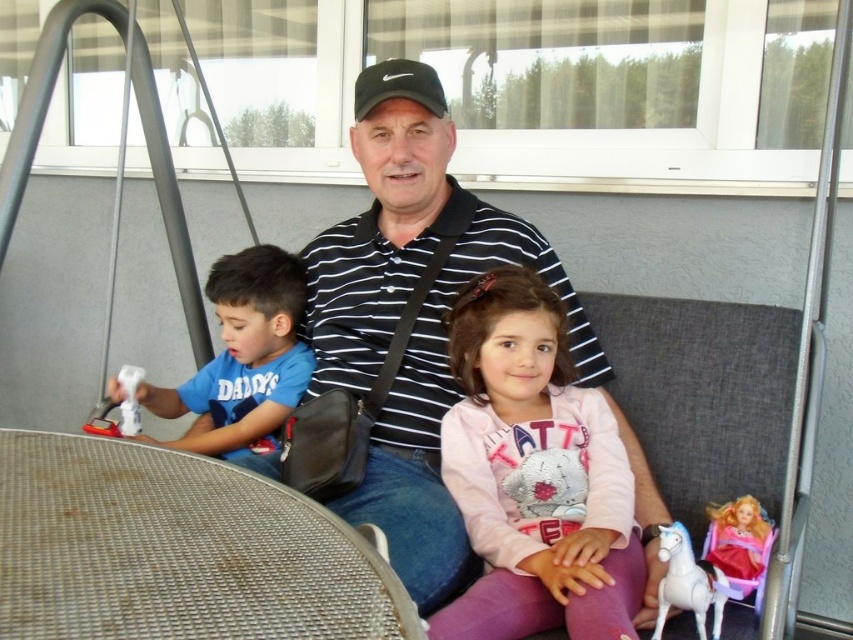
Question: Is shiny plastic doll at lower right positioned at the back of black matte baseball cap at center?

Choices:
 (A) no
 (B) yes

Answer: (A)

Question: Which object is positioned farthest from the white plastic swing at left?

Choices:
 (A) shiny plastic doll at lower right
 (B) black striped shirt at center
 (C) white plastic toy at left
 (D) pink fleece jacket at center

Answer: (A)

Question: Among these objects, which one is nearest to the camera?

Choices:
 (A) white plastic toy at left
 (B) white plastic horse at lower right

Answer: (B)

Question: Where is black matte baseball cap at center located in relation to white plastic toy at left in the image?

Choices:
 (A) above
 (B) below

Answer: (A)

Question: Which object appears farthest from the camera in this image?

Choices:
 (A) white plastic swing at left
 (B) white plastic horse at lower right
 (C) pink fleece jacket at center
 (D) blue cotton shirt at left

Answer: (A)

Question: Is white plastic swing at left positioned behind white plastic toy at left?

Choices:
 (A) no
 (B) yes

Answer: (B)